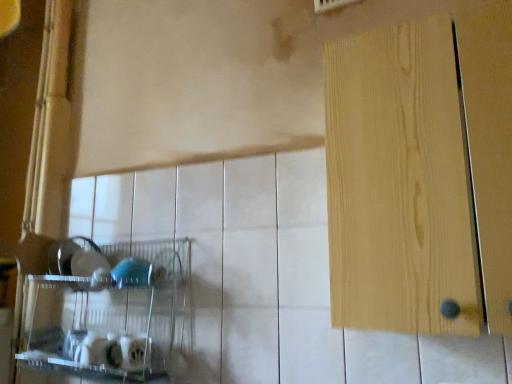
Question: Considering the positions of clear plastic shelf at lower left and light wood door at right in the image, is clear plastic shelf at lower left wider or thinner than light wood door at right?

Choices:
 (A) thin
 (B) wide

Answer: (A)

Question: Do you think clear plastic shelf at lower left is within light wood door at right, or outside of it?

Choices:
 (A) outside
 (B) inside

Answer: (A)

Question: Is clear plastic shelf at lower left bigger or smaller than light wood door at right?

Choices:
 (A) small
 (B) big

Answer: (A)

Question: Considering the positions of point (332, 61) and point (177, 321), is point (332, 61) closer or farther from the camera than point (177, 321)?

Choices:
 (A) farther
 (B) closer

Answer: (B)

Question: Looking at their shapes, would you say light wood door at right is wider or thinner than clear plastic shelf at lower left?

Choices:
 (A) thin
 (B) wide

Answer: (B)

Question: Do you think light wood door at right is within clear plastic shelf at lower left, or outside of it?

Choices:
 (A) inside
 (B) outside

Answer: (B)

Question: In terms of size, does light wood door at right appear bigger or smaller than clear plastic shelf at lower left?

Choices:
 (A) small
 (B) big

Answer: (B)